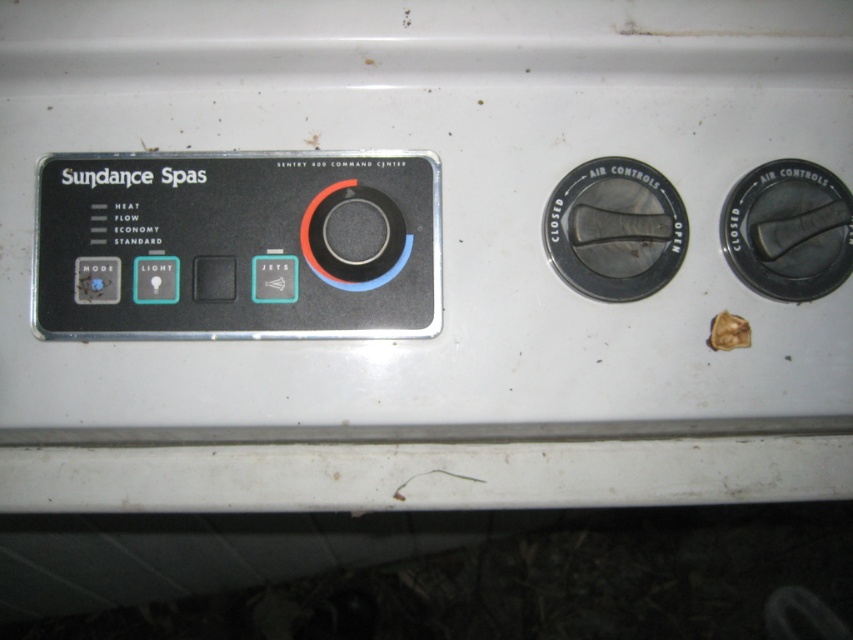
Measure the distance from black plastic air control at right to matte plastic button at center.

black plastic air control at right is 38.43 centimeters from matte plastic button at center.

Find the location of `black plastic air control at right`. black plastic air control at right is located at coordinates (788, 228).

Is matte plastic light at center left shorter than matte plastic button at center?

Incorrect, matte plastic light at center left's height does not fall short of matte plastic button at center's.

Does point (171, 269) lie in front of point (212, 278)?

Yes.

Who is more forward, (146,288) or (229,300)?

Positioned in front is point (146,288).

Where is `matte plastic light at center left`? Image resolution: width=853 pixels, height=640 pixels. matte plastic light at center left is located at coordinates (155, 280).

Does black plastic dial at center appear on the right side of matte plastic button at center?

Correct, you'll find black plastic dial at center to the right of matte plastic button at center.

Can you confirm if black plastic dial at center is wider than matte plastic button at center?

Correct, the width of black plastic dial at center exceeds that of matte plastic button at center.

Between point (408, 244) and point (233, 273), which one is positioned in front?

Positioned in front is point (233, 273).

The height and width of the screenshot is (640, 853). Identify the location of black plastic dial at center. (341, 252).